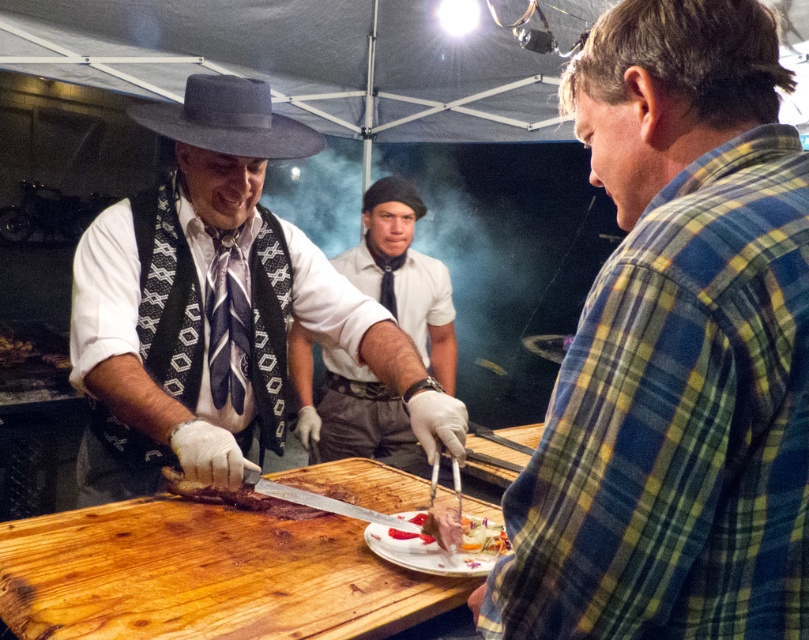
You are a photographer at the event and want to capture a photo of both the white shirt at center and the smooth white cheese at center in the same frame. What is the minimum distance you need to move backward to include both in your shot?

The white shirt at center and the smooth white cheese at center are 4.66 feet apart. To include both in the same frame, you need to move backward until the camera can cover at least 4.66 feet in width. The exact distance depends on the camera lens and sensor size, but ensuring the frame width accommodates this distance would work.

You are a photographer at the event and need to focus your camera on both the matte black vest at center and the smooth white cheese at center. Which object should you adjust your focus to first if you want to capture them both clearly in the same frame?

The matte black vest at center is larger in size compared to the smooth white cheese at center, so you should focus on the matte black vest at center first to ensure it is sharp, then adjust slightly for the smaller smooth white cheese at center.

You are a photographer at the event and want to capture a photo of both the white shirt at center and the smooth white cheese at center without any overlap. Based on their positions, which one should you position on the left side of the frame?

The white shirt at center is to the left of the smooth white cheese at center, so to avoid overlap, you should position the white shirt at center on the left side of the frame and the smooth white cheese at center on the right side.